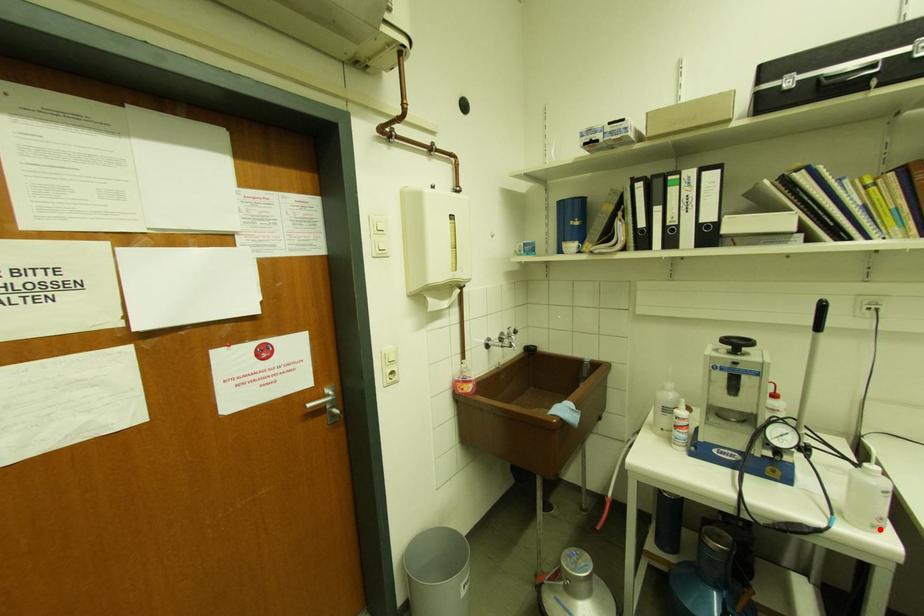
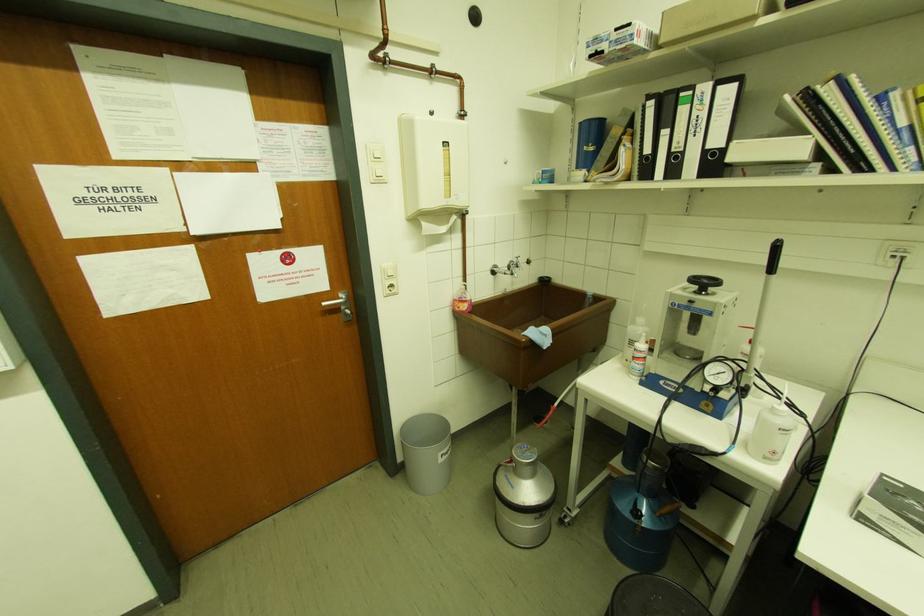
Question: A red point is marked in image1. In image2, is the corresponding 3D point closer to the camera or farther? Reply with the corresponding letter.

Choices:
 (A) The corresponding 3D point is closer.
 (B) The corresponding 3D point is farther.

Answer: (A)